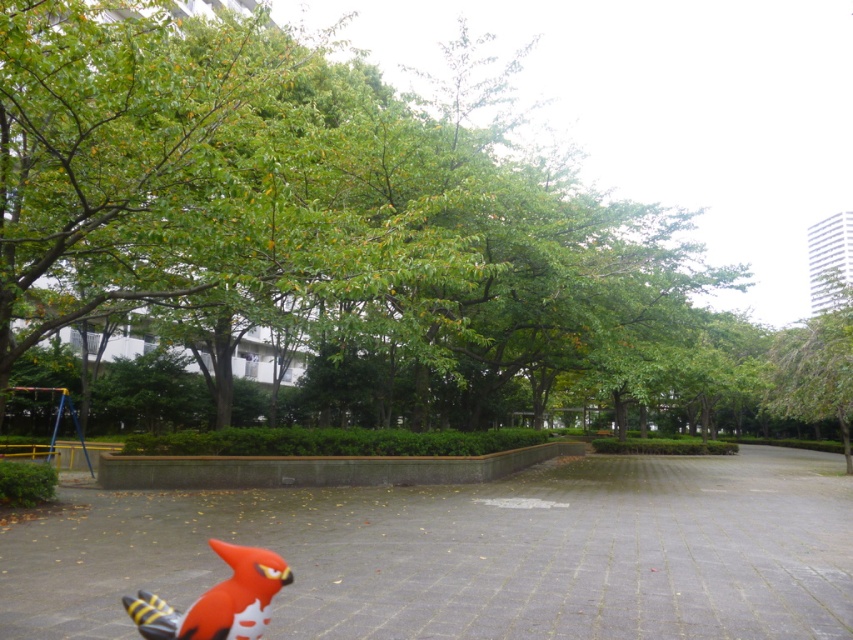
You are standing on the smooth concrete path at center and want to walk towards the green leafy tree at upper right. Which direction should you move to get closer to the tree?

To get closer to the green leafy tree at upper right, you should move forward since the smooth concrete path at center is closer to the viewer than the tree, indicating it is in front of the tree.

You are planning to plant a new tree in the park. The green leafy tree at center and the smooth concrete path at center are already present. Based on their positions, where should the new tree be placed relative to the existing path?

The green leafy tree at center is located above the smooth concrete path at center, so the new tree should be planted above the existing path to maintain alignment with the existing tree.